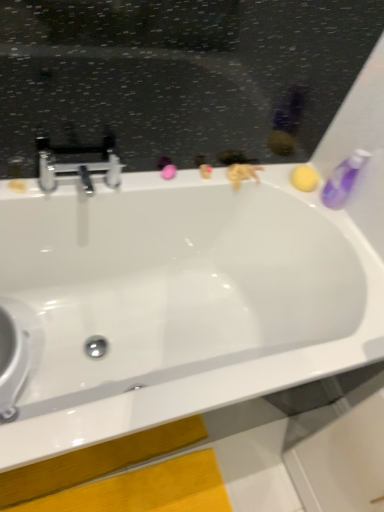
Question: Can you confirm if white glossy bathtub at center is wider than polished chrome faucet at upper left?

Choices:
 (A) yes
 (B) no

Answer: (A)

Question: From a real-world perspective, is white glossy bathtub at center located beneath polished chrome faucet at upper left?

Choices:
 (A) no
 (B) yes

Answer: (B)

Question: Is white glossy bathtub at center surrounding polished chrome faucet at upper left?

Choices:
 (A) yes
 (B) no

Answer: (B)

Question: Is white glossy bathtub at center behind polished chrome faucet at upper left?

Choices:
 (A) no
 (B) yes

Answer: (A)

Question: Does white glossy bathtub at center lie in front of polished chrome faucet at upper left?

Choices:
 (A) no
 (B) yes

Answer: (B)

Question: Would you say polished chrome faucet at upper left is inside or outside white glossy bathtub at center?

Choices:
 (A) inside
 (B) outside

Answer: (B)

Question: In the image, is polished chrome faucet at upper left on the left side or the right side of white glossy bathtub at center?

Choices:
 (A) left
 (B) right

Answer: (A)

Question: Based on their sizes in the image, would you say polished chrome faucet at upper left is bigger or smaller than white glossy bathtub at center?

Choices:
 (A) small
 (B) big

Answer: (A)

Question: Is point (79, 169) closer or farther from the camera than point (183, 204)?

Choices:
 (A) farther
 (B) closer

Answer: (B)

Question: Based on their positions, is polished chrome faucet at upper left located to the left or right of purple translucent bottle at upper right?

Choices:
 (A) left
 (B) right

Answer: (A)

Question: From a real-world perspective, is polished chrome faucet at upper left above or below purple translucent bottle at upper right?

Choices:
 (A) below
 (B) above

Answer: (A)

Question: From the image's perspective, is polished chrome faucet at upper left located above or below purple translucent bottle at upper right?

Choices:
 (A) below
 (B) above

Answer: (A)

Question: Relative to purple translucent bottle at upper right, is polished chrome faucet at upper left in front or behind?

Choices:
 (A) behind
 (B) front

Answer: (B)

Question: From the image's perspective, is purple translucent bottle at upper right positioned above or below white glossy bathtub at center?

Choices:
 (A) above
 (B) below

Answer: (A)

Question: Visually, is purple translucent bottle at upper right positioned to the left or to the right of white glossy bathtub at center?

Choices:
 (A) right
 (B) left

Answer: (A)